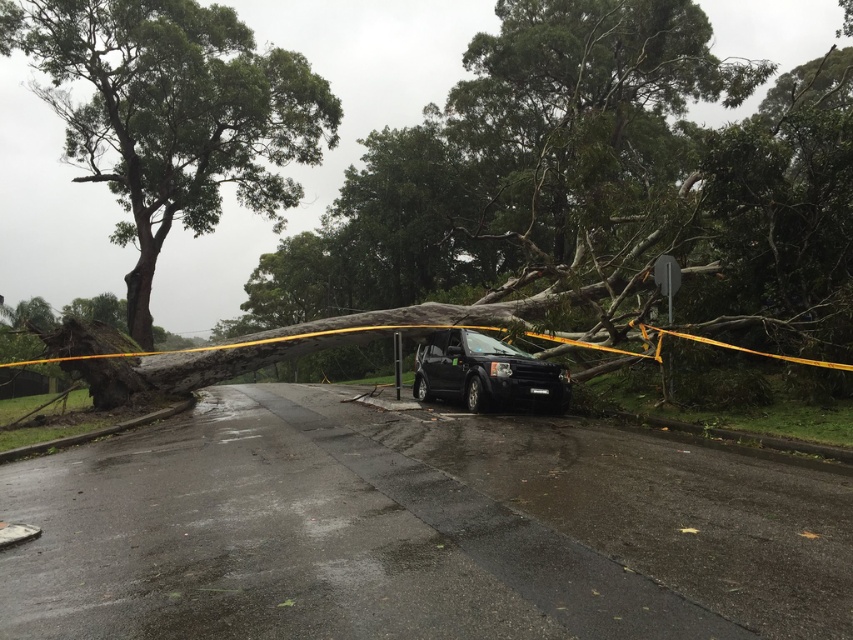
You are a driver trying to navigate around the fallen tree blocking the road. There is a point marked at coordinates (595, 188). Based on the scene, what object is located at that point?

The point at coordinates (595, 188) corresponds to the dark gray bark tree at center, which is the fallen tree blocking the road.